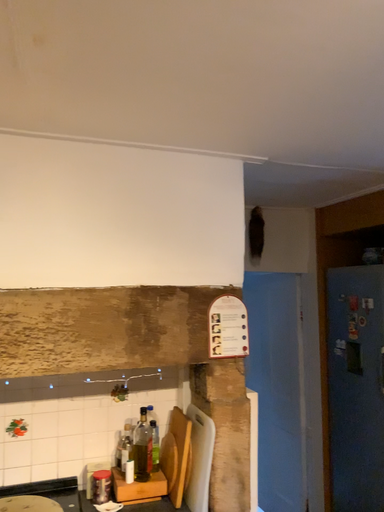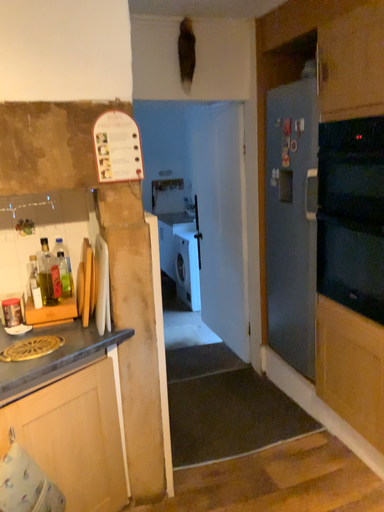
Question: How did the camera likely rotate when shooting the video?

Choices:
 (A) rotated downward
 (B) rotated upward

Answer: (A)